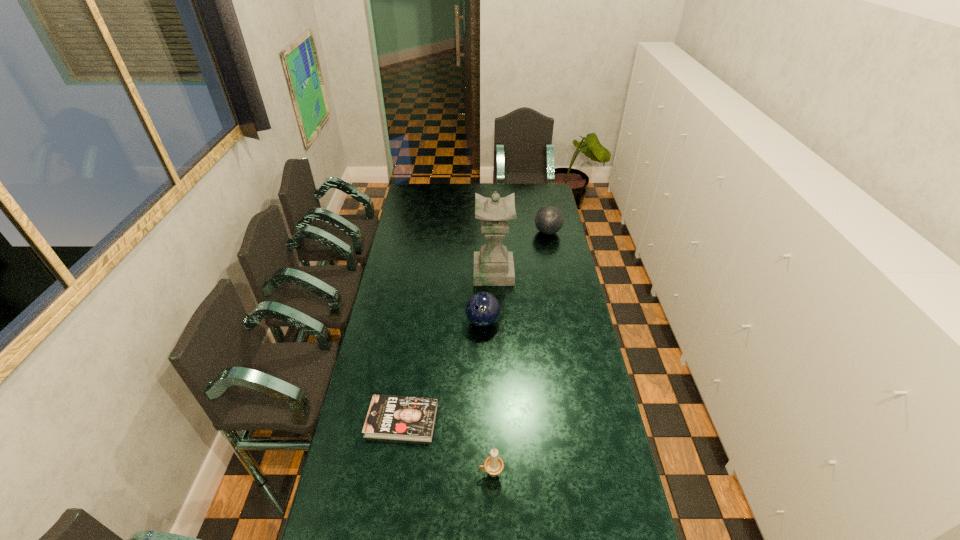
Find the location of a particular element. The image size is (960, 540). the tallest object is located at coordinates (493, 266).

Find the location of a particular element. The width and height of the screenshot is (960, 540). the second farthest object is located at coordinates (493, 266).

I want to click on the farthest object, so click(548, 220).

What are the coordinates of `the rightmost object` in the screenshot? It's located at (548, 220).

The width and height of the screenshot is (960, 540). I want to click on the nearer bowling ball, so click(482, 309).

Locate an element on the screen. This screenshot has height=540, width=960. the left bowling ball is located at coordinates (482, 309).

Where is `candle_holder`? candle_holder is located at coordinates (493, 465).

The height and width of the screenshot is (540, 960). Find the location of `book`. book is located at coordinates (403, 418).

Find the location of `the shortest object`. the shortest object is located at coordinates (403, 418).

This screenshot has height=540, width=960. I want to click on vacant region located at the front opening of the second farthest object, so click(x=393, y=272).